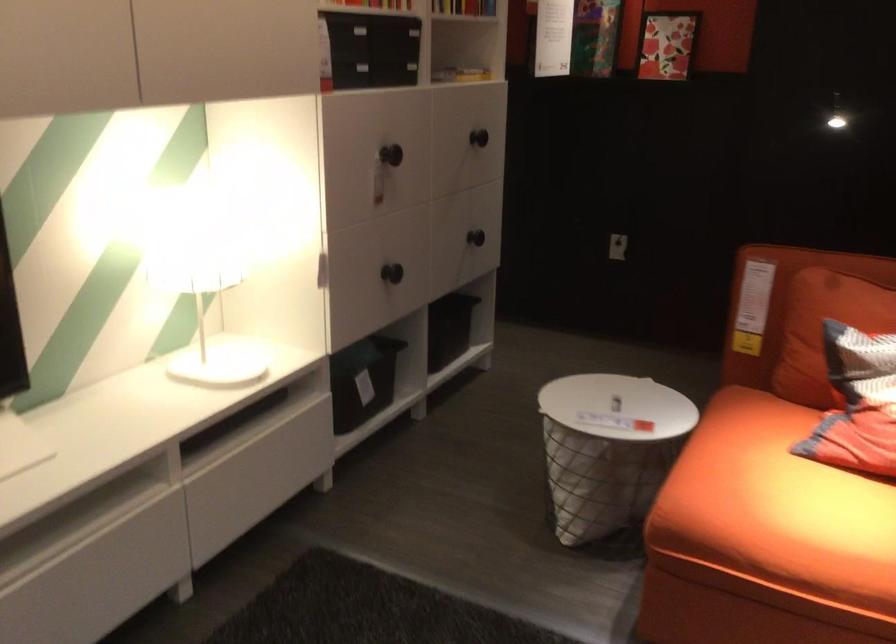
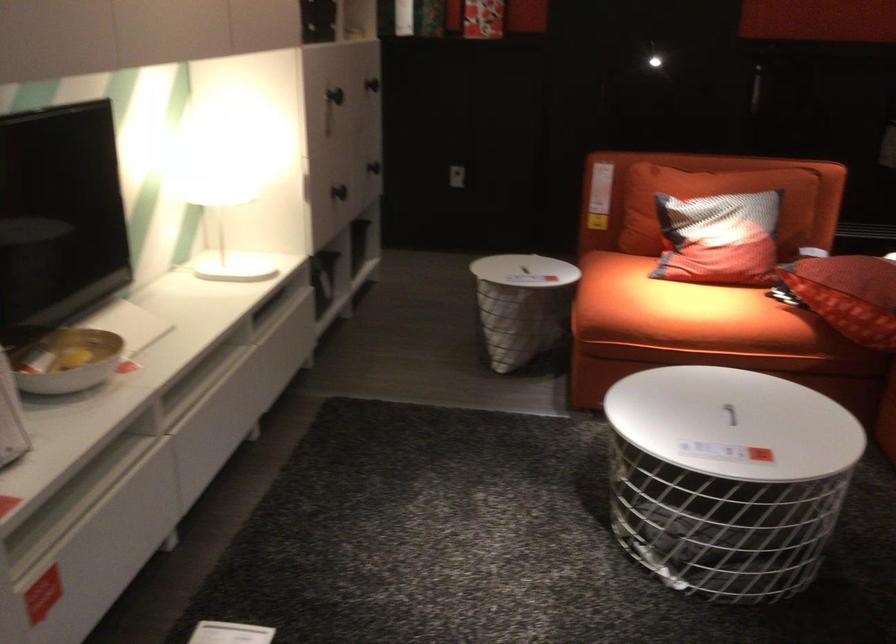
Locate, in the second image, the point that corresponds to [392,269] in the first image.

(339, 192)